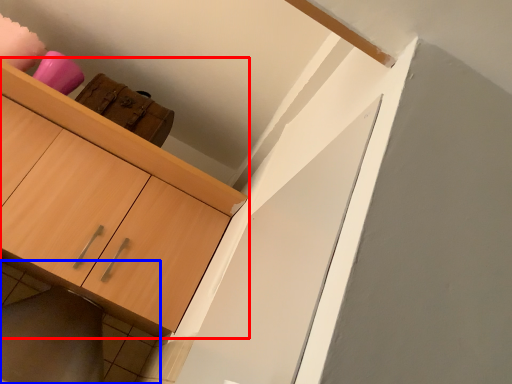
Question: Which of the following is the closest to the observer, cabinetry (highlighted by a red box) or tile (highlighted by a blue box)?

Choices:
 (A) cabinetry
 (B) tile

Answer: (A)